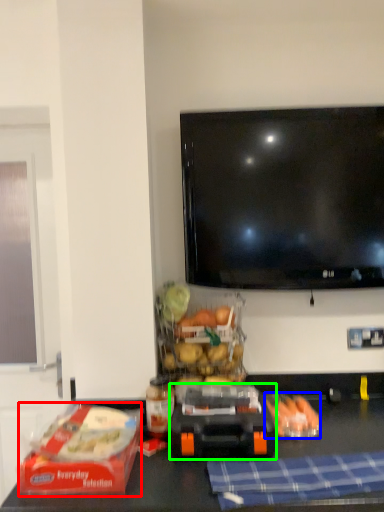
Question: Which object is positioned closest to lunch box (highlighted by a red box)? Select from food (highlighted by a blue box) and appliance (highlighted by a green box).

Choices:
 (A) food
 (B) appliance

Answer: (B)